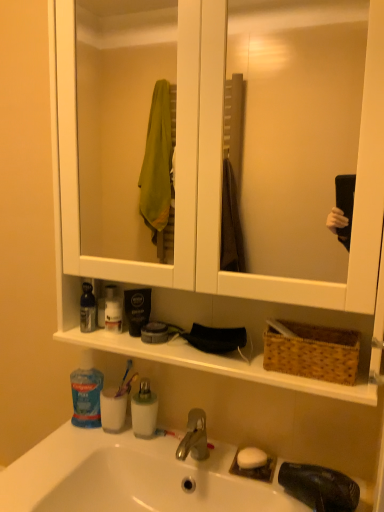
Where is `vacant area that is in front of white plastic toothbrush at center, the 2th toothbrush when ordered from top to bottom`? This screenshot has width=384, height=512. vacant area that is in front of white plastic toothbrush at center, the 2th toothbrush when ordered from top to bottom is located at coordinates (202, 470).